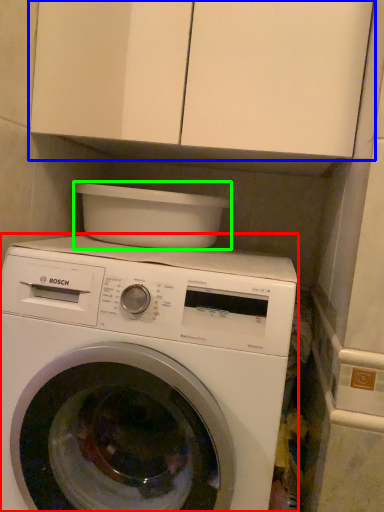
Question: Considering the real-world distances, which object is closest to washing machine (highlighted by a red box)? cabinetry (highlighted by a blue box) or appliance (highlighted by a green box).

Choices:
 (A) cabinetry
 (B) appliance

Answer: (B)